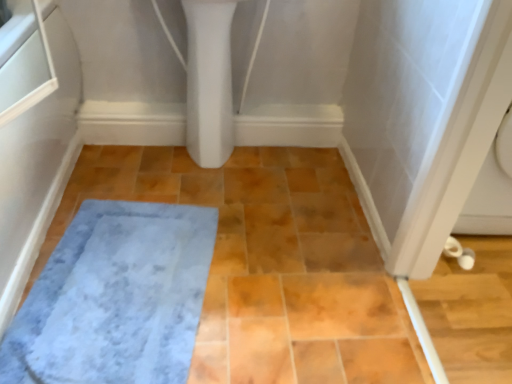
You are a GUI agent. You are given a task and a screenshot of the screen. Output one action in this format:
    pyautogui.click(x=<x>, y=<y>)
    Task: Click on the white glossy bidet at upper center
    This screenshot has width=512, height=384.
    Given the screenshot: What is the action you would take?
    pyautogui.click(x=209, y=81)

This screenshot has height=384, width=512. What do you see at coordinates (209, 81) in the screenshot? I see `white glossy bidet at upper center` at bounding box center [209, 81].

In order to face white glossy bidet at upper center, should I rotate leftwards or rightwards?

Rotate left and turn 5.893 degrees.

Identify the location of gray plush bath mat at lower left. (115, 298).

The width and height of the screenshot is (512, 384). Describe the element at coordinates (115, 298) in the screenshot. I see `gray plush bath mat at lower left` at that location.

Measure the distance between point (84,242) and camera.

Point (84,242) and camera are 1.38 meters apart.

Identify the location of white glossy bidet at upper center. (209, 81).

In the scene shown: Would you say white glossy bidet at upper center is to the left or to the right of gray plush bath mat at lower left in the picture?

Based on their positions, white glossy bidet at upper center is located to the right of gray plush bath mat at lower left.

Is white glossy bidet at upper center further to the viewer compared to gray plush bath mat at lower left?

Yes.

Is point (201, 130) positioned before point (187, 206)?

No, (201, 130) is further to viewer.

From the image's perspective, who appears lower, white glossy bidet at upper center or gray plush bath mat at lower left?

gray plush bath mat at lower left is shown below in the image.

In the scene shown: From a real-world perspective, does white glossy bidet at upper center stand above gray plush bath mat at lower left?

Yes, from a real-world perspective, white glossy bidet at upper center is above gray plush bath mat at lower left.

Is white glossy bidet at upper center thinner than gray plush bath mat at lower left?

Indeed, white glossy bidet at upper center has a lesser width compared to gray plush bath mat at lower left.

Is white glossy bidet at upper center taller or shorter than gray plush bath mat at lower left?

Clearly, white glossy bidet at upper center is taller compared to gray plush bath mat at lower left.

Can you confirm if white glossy bidet at upper center is smaller than gray plush bath mat at lower left?

Actually, white glossy bidet at upper center might be larger than gray plush bath mat at lower left.

Is gray plush bath mat at lower left surrounded by white glossy bidet at upper center?

No.

Are white glossy bidet at upper center and gray plush bath mat at lower left far apart?

white glossy bidet at upper center is near gray plush bath mat at lower left, not far away.

Could you tell me if white glossy bidet at upper center is turned towards gray plush bath mat at lower left?

No.

Can you tell me how much white glossy bidet at upper center and gray plush bath mat at lower left differ in facing direction?

The angular difference between white glossy bidet at upper center and gray plush bath mat at lower left is 88.4 degrees.

Find the location of a particular element. bath mat located on the left of white glossy bidet at upper center is located at coordinates (115, 298).

Consider the image. Between gray plush bath mat at lower left and white glossy bidet at upper center, which one appears on the left side from the viewer's perspective?

From the viewer's perspective, gray plush bath mat at lower left appears more on the left side.

Is gray plush bath mat at lower left further to the viewer compared to white glossy bidet at upper center?

No, gray plush bath mat at lower left is closer to the viewer.

Between point (98, 328) and point (195, 158), which one is positioned behind?

The point (195, 158) is behind.

From the image's perspective, is gray plush bath mat at lower left above or below white glossy bidet at upper center?

gray plush bath mat at lower left is situated lower than white glossy bidet at upper center in the image.

Consider the image. From a real-world perspective, is gray plush bath mat at lower left located beneath white glossy bidet at upper center?

Indeed, from a real-world perspective, gray plush bath mat at lower left is positioned beneath white glossy bidet at upper center.

Considering the relative sizes of gray plush bath mat at lower left and white glossy bidet at upper center in the image provided, is gray plush bath mat at lower left thinner than white glossy bidet at upper center?

No.

Considering the relative sizes of gray plush bath mat at lower left and white glossy bidet at upper center in the image provided, is gray plush bath mat at lower left shorter than white glossy bidet at upper center?

Yes.

Considering the sizes of objects gray plush bath mat at lower left and white glossy bidet at upper center in the image provided, who is bigger, gray plush bath mat at lower left or white glossy bidet at upper center?

Bigger between the two is white glossy bidet at upper center.

Is gray plush bath mat at lower left completely or partially outside of white glossy bidet at upper center?

Indeed, gray plush bath mat at lower left is completely outside white glossy bidet at upper center.

Is gray plush bath mat at lower left next to white glossy bidet at upper center?

No, gray plush bath mat at lower left is not making contact with white glossy bidet at upper center.

Is gray plush bath mat at lower left turned away from white glossy bidet at upper center?

gray plush bath mat at lower left is not turned away from white glossy bidet at upper center.

How different are the orientations of gray plush bath mat at lower left and white glossy bidet at upper center in degrees?

They differ by 88.4 degrees in their facing directions.

Find the location of `bath mat that is in front of the white glossy bidet at upper center`. bath mat that is in front of the white glossy bidet at upper center is located at coordinates (115, 298).

Locate an element on the screen. This screenshot has height=384, width=512. bath mat in front of the white glossy bidet at upper center is located at coordinates (115, 298).

Where is `bath mat below the white glossy bidet at upper center (from the image's perspective)`? The height and width of the screenshot is (384, 512). bath mat below the white glossy bidet at upper center (from the image's perspective) is located at coordinates (115, 298).